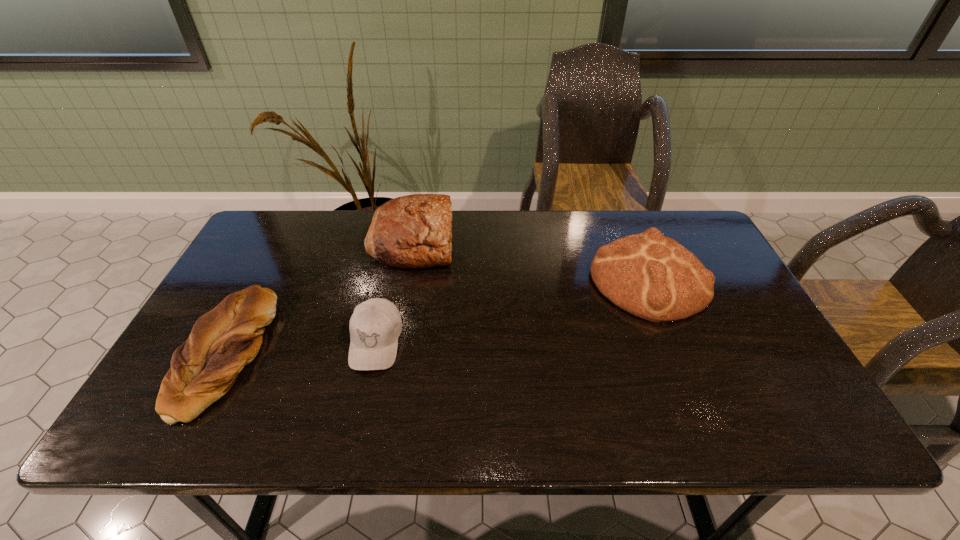
Find the location of `object that is the closest to the baseball cap`. object that is the closest to the baseball cap is located at coordinates (414, 231).

Identify which object is the second nearest to the second bread from left to right. Please provide its 2D coordinates. Your answer should be formatted as a tuple, i.e. [(x, y)], where the tuple contains the x and y coordinates of a point satisfying the conditions above.

[(224, 340)]

Select which bread appears as the second closest to the leftmost bread. Please provide its 2D coordinates. Your answer should be formatted as a tuple, i.e. [(x, y)], where the tuple contains the x and y coordinates of a point satisfying the conditions above.

[(653, 277)]

You are a GUI agent. You are given a task and a screenshot of the screen. Output one action in this format:
    pyautogui.click(x=<x>, y=<y>)
    Task: Click on the bread that is the nearest to the second shortest bread
    Image resolution: width=960 pixels, height=540 pixels.
    Given the screenshot: What is the action you would take?
    pyautogui.click(x=414, y=231)

Locate an element on the screen. Image resolution: width=960 pixels, height=540 pixels. vacant region that satisfies the following two spatial constraints: 1. at the sliced front of the rightmost bread; 2. on the left side of the second bread from left to right is located at coordinates (405, 280).

Locate an element on the screen. free location that satisfies the following two spatial constraints: 1. at the sliced front of the tallest bread; 2. on the left side of the second tallest object is located at coordinates (405, 280).

Where is `vacant space that satisfies the following two spatial constraints: 1. at the sliced front of the second bread from left to right; 2. on the front-facing side of the second shortest object`? Image resolution: width=960 pixels, height=540 pixels. vacant space that satisfies the following two spatial constraints: 1. at the sliced front of the second bread from left to right; 2. on the front-facing side of the second shortest object is located at coordinates (395, 342).